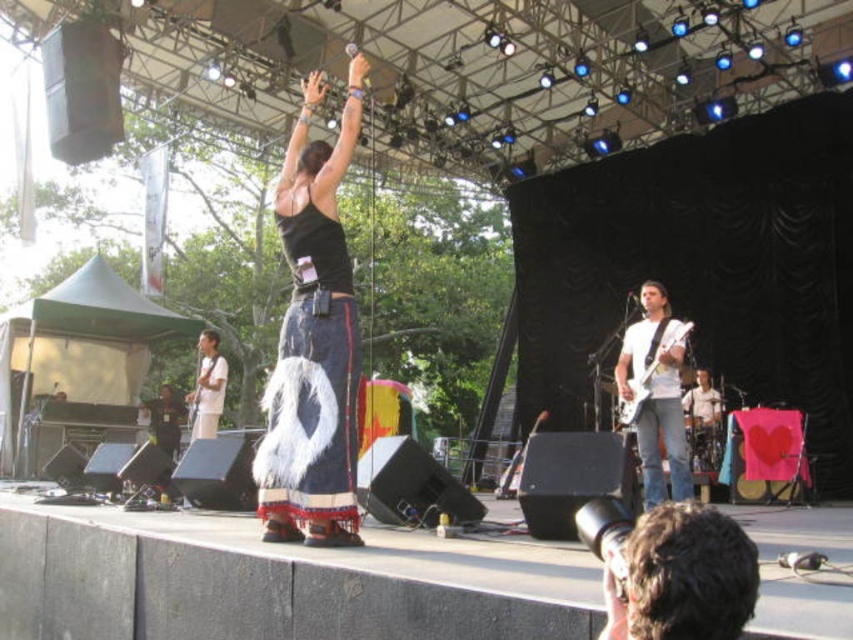
Which is more to the left, black denim skirt at center or dark brown hair at lower right?

From the viewer's perspective, black denim skirt at center appears more on the left side.

Between black denim skirt at center and dark brown hair at lower right, which one is positioned higher?

black denim skirt at center

Is point (299, 484) closer to camera compared to point (730, 525)?

No, (299, 484) is further to viewer.

Where is `black denim skirt at center`? black denim skirt at center is located at coordinates (312, 342).

Does point (621, 384) come behind point (682, 332)?

Yes.

I want to click on white matte guitar at center, so click(656, 396).

Where is `white matte guitar at center`? This screenshot has height=640, width=853. white matte guitar at center is located at coordinates (656, 396).

Is black denim skirt at center wider than white matte guitar at center?

Incorrect, black denim skirt at center's width does not surpass white matte guitar at center's.

Between point (282, 177) and point (654, 452), which one is positioned in front?

Point (282, 177)

Find the location of `black denim skirt at center`. black denim skirt at center is located at coordinates (312, 342).